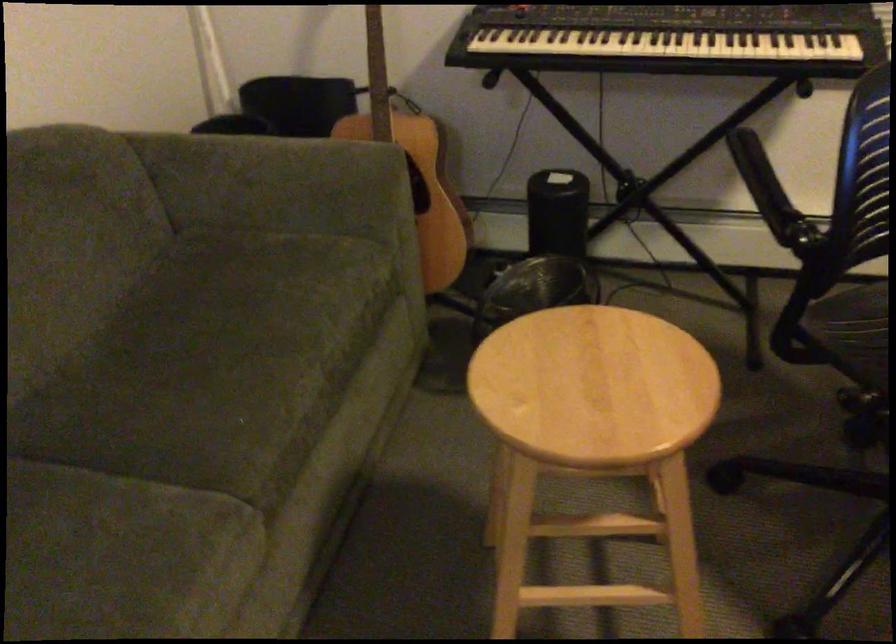
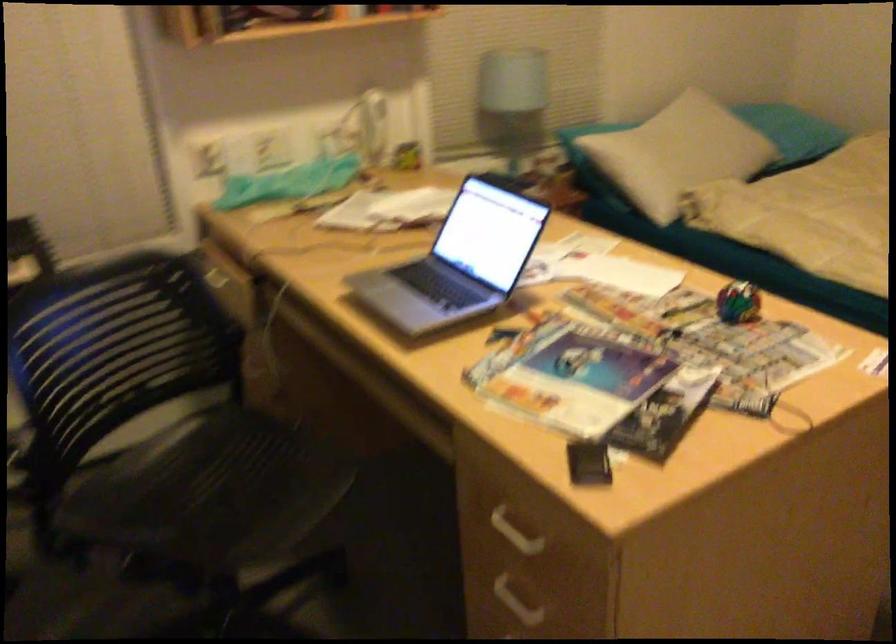
Question: The camera is either moving clockwise (left) or counter-clockwise (right) around the object. The first image is from the beginning of the video and the second image is from the end. Is the camera moving left or right when shooting the video?

Choices:
 (A) Left
 (B) Right

Answer: (A)